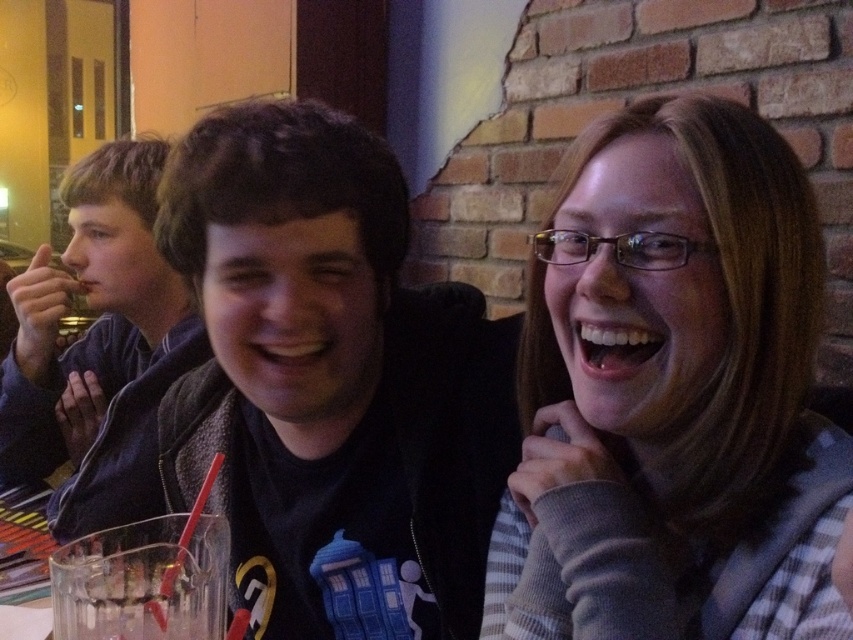
Is point (575, 324) behind point (55, 269)?

No, (575, 324) is in front of (55, 269).

Image resolution: width=853 pixels, height=640 pixels. I want to click on plaid shirt at center, so click(x=672, y=394).

Which is above, black matte jacket at center or clear glass cup at lower left?

black matte jacket at center is above.

Does black matte jacket at center have a larger size compared to clear glass cup at lower left?

Correct, black matte jacket at center is larger in size than clear glass cup at lower left.

Is point (447, 480) farther from viewer compared to point (157, 570)?

Yes, point (447, 480) is farther from viewer.

You are a GUI agent. You are given a task and a screenshot of the screen. Output one action in this format:
    pyautogui.click(x=<x>, y=<y>)
    Task: Click on the black matte jacket at center
    
    Given the screenshot: What is the action you would take?
    334,360

Is plaid shirt at center smaller than clear glass cup at lower left?

No, plaid shirt at center is not smaller than clear glass cup at lower left.

Find the location of a particular element. plaid shirt at center is located at coordinates (672, 394).